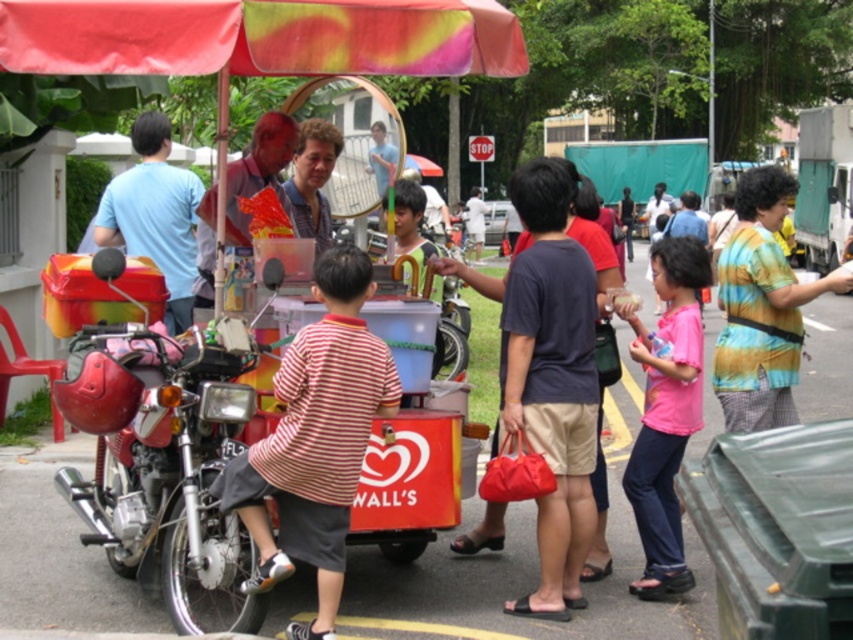
Question: Among these points, which one is farthest from the camera?

Choices:
 (A) (799, 216)
 (B) (154, 250)

Answer: (A)

Question: Does light blue shirt at left have a lesser width compared to metallic silver food truck at right?

Choices:
 (A) yes
 (B) no

Answer: (A)

Question: Considering the relative positions of light blue shirt at left and metallic silver food truck at right in the image provided, where is light blue shirt at left located with respect to metallic silver food truck at right?

Choices:
 (A) above
 (B) below

Answer: (B)

Question: Which point appears farthest from the camera in this image?

Choices:
 (A) (190, 248)
 (B) (813, 218)

Answer: (B)

Question: Is light blue shirt at left to the right of metallic silver food truck at right from the viewer's perspective?

Choices:
 (A) yes
 (B) no

Answer: (B)

Question: Which point is farther to the camera?

Choices:
 (A) (822, 145)
 (B) (169, 141)

Answer: (A)